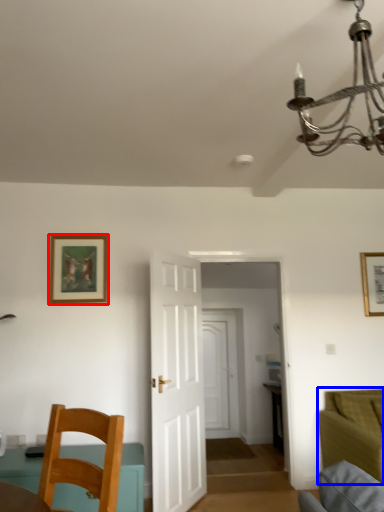
Question: Which of the following is the closest to the observer, picture frame (highlighted by a red box) or couch (highlighted by a blue box)?

Choices:
 (A) picture frame
 (B) couch

Answer: (B)